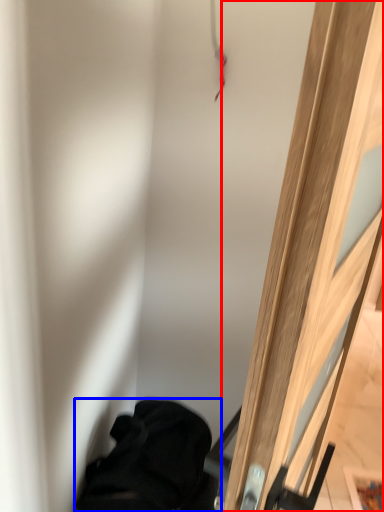
Question: Which of the following is the closest to the observer, door (highlighted by a red box) or furniture (highlighted by a blue box)?

Choices:
 (A) door
 (B) furniture

Answer: (A)